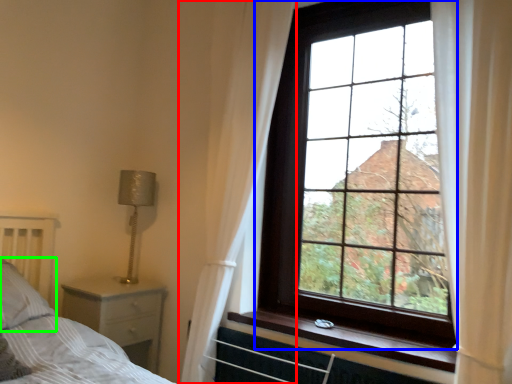
Question: Which object is positioned farthest from curtain (highlighted by a red box)? Select from window (highlighted by a blue box) and pillow (highlighted by a green box).

Choices:
 (A) window
 (B) pillow

Answer: (B)